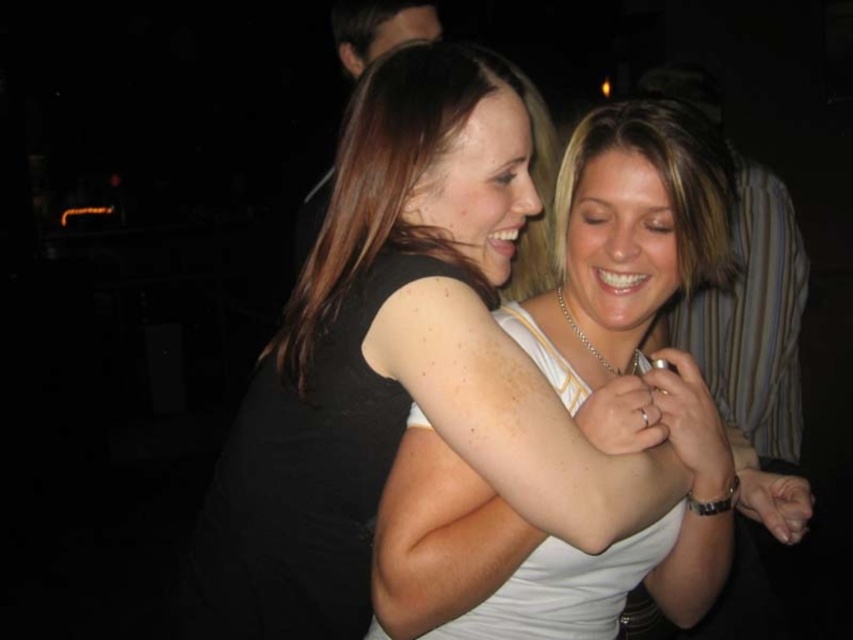
Question: Can you confirm if white tank top at center is wider than smooth black shirt at upper center?

Choices:
 (A) yes
 (B) no

Answer: (A)

Question: Among these points, which one is nearest to the camera?

Choices:
 (A) (566, 244)
 (B) (273, 342)

Answer: (A)

Question: Can you confirm if white tank top at center is wider than smooth black shirt at upper center?

Choices:
 (A) no
 (B) yes

Answer: (B)

Question: Is white tank top at center to the right of smooth black shirt at upper center from the viewer's perspective?

Choices:
 (A) no
 (B) yes

Answer: (B)

Question: Which point appears closest to the camera in this image?

Choices:
 (A) (706, 410)
 (B) (306, 352)

Answer: (A)

Question: Among these points, which one is nearest to the camera?

Choices:
 (A) (561, 577)
 (B) (360, 230)

Answer: (B)